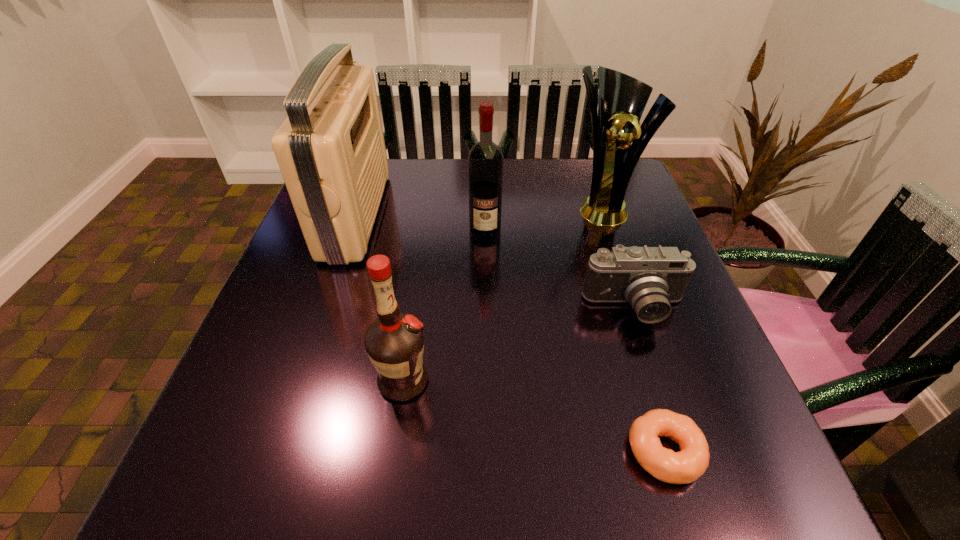
Find the location of a particular element. This screenshot has width=960, height=540. camera that is at the right edge is located at coordinates (649, 278).

Locate an element on the screen. This screenshot has height=540, width=960. doughnut present at the right edge is located at coordinates (687, 465).

Locate an element on the screen. object that is at the far left corner is located at coordinates (331, 152).

At what (x,y) coordinates should I click in order to perform the action: click on object at the far right corner. Please return your answer as a coordinate pair (x, y). This screenshot has width=960, height=540. Looking at the image, I should click on (622, 99).

Locate an element on the screen. object that is positioned at the near right corner is located at coordinates (687, 465).

Image resolution: width=960 pixels, height=540 pixels. In the image, there is a desktop. In order to click on vacant space at the far edge in this screenshot , I will do point(442,168).

In order to click on free region at the near edge in this screenshot , I will do `click(382, 450)`.

This screenshot has width=960, height=540. In the image, there is a desktop. In order to click on vacant space at the left edge in this screenshot , I will do [263, 411].

Where is `free space at the right edge of the desktop`? This screenshot has width=960, height=540. free space at the right edge of the desktop is located at coordinates (636, 359).

At what (x,y) coordinates should I click in order to perform the action: click on vacant region at the near left corner of the desktop. Please return your answer as a coordinate pair (x, y). This screenshot has height=540, width=960. Looking at the image, I should click on (251, 480).